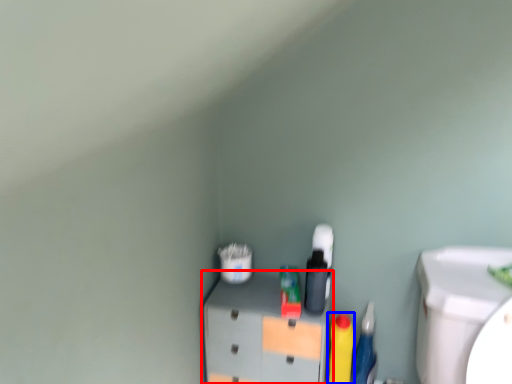
Question: Which of the following is the farthest to the observer, furniture (highlighted by a red box) or cleaning product (highlighted by a blue box)?

Choices:
 (A) furniture
 (B) cleaning product

Answer: (B)